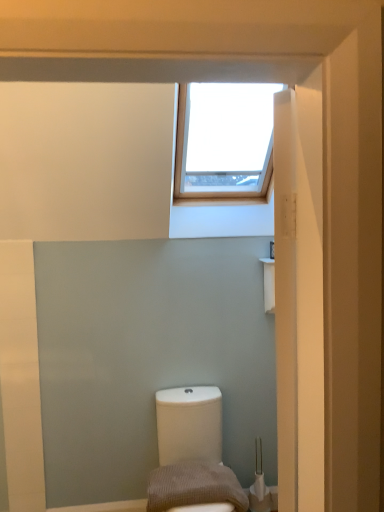
Question: Can you confirm if brown textured pillow at lower center is smaller than white glossy toilet at lower center?

Choices:
 (A) yes
 (B) no

Answer: (A)

Question: Does brown textured pillow at lower center have a greater height compared to white glossy toilet at lower center?

Choices:
 (A) yes
 (B) no

Answer: (B)

Question: Could you tell me if brown textured pillow at lower center is turned towards white glossy toilet at lower center?

Choices:
 (A) no
 (B) yes

Answer: (B)

Question: From a real-world perspective, is brown textured pillow at lower center on white glossy toilet at lower center?

Choices:
 (A) yes
 (B) no

Answer: (A)

Question: Is brown textured pillow at lower center at the right side of white glossy toilet at lower center?

Choices:
 (A) no
 (B) yes

Answer: (A)

Question: Is brown textured pillow at lower center not near white glossy toilet at lower center?

Choices:
 (A) no
 (B) yes

Answer: (A)

Question: Is white glossy toilet at lower center positioned beyond the bounds of brown textured pillow at lower center?

Choices:
 (A) no
 (B) yes

Answer: (B)

Question: Can you confirm if white glossy toilet at lower center is wider than brown textured pillow at lower center?

Choices:
 (A) no
 (B) yes

Answer: (B)

Question: From the image's perspective, is white glossy toilet at lower center beneath brown textured pillow at lower center?

Choices:
 (A) yes
 (B) no

Answer: (A)

Question: Does white glossy toilet at lower center have a lesser height compared to brown textured pillow at lower center?

Choices:
 (A) yes
 (B) no

Answer: (B)

Question: Can you confirm if white glossy toilet at lower center is bigger than brown textured pillow at lower center?

Choices:
 (A) no
 (B) yes

Answer: (B)

Question: Considering the relative sizes of white glossy toilet at lower center and brown textured pillow at lower center in the image provided, is white glossy toilet at lower center taller than brown textured pillow at lower center?

Choices:
 (A) no
 (B) yes

Answer: (B)

Question: From a real-world perspective, relative to brown textured pillow at lower center, is white glossy toilet at lower center vertically above or below?

Choices:
 (A) above
 (B) below

Answer: (B)